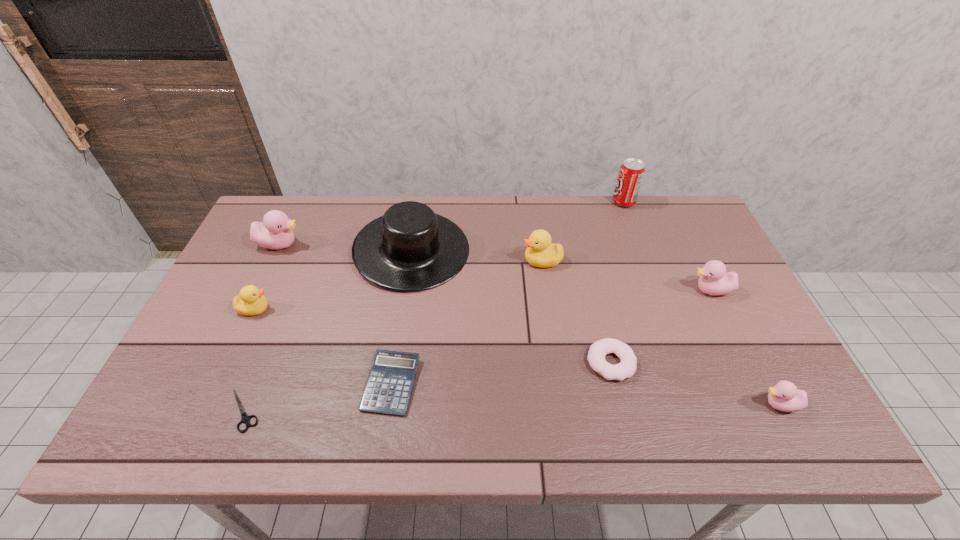
Where is `the smallest pink duckling`? the smallest pink duckling is located at coordinates (784, 396).

Where is `the nearest duckling`? This screenshot has width=960, height=540. the nearest duckling is located at coordinates (784, 396).

The height and width of the screenshot is (540, 960). I want to click on the eighth tallest object, so click(626, 368).

At what (x,y) coordinates should I click in order to perform the action: click on the fourth object from right to left. Please return your answer as a coordinate pair (x, y). Looking at the image, I should click on (626, 368).

Where is `calculator`? The image size is (960, 540). calculator is located at coordinates (389, 386).

The height and width of the screenshot is (540, 960). I want to click on black shears, so click(245, 418).

Find the location of `shears`. shears is located at coordinates (245, 418).

The image size is (960, 540). In order to click on vacant space located 0.190m on the left of the farthest object in this screenshot , I will do `click(557, 202)`.

Where is `vacant space situated on the right of the dress hat`? vacant space situated on the right of the dress hat is located at coordinates (584, 251).

Where is `vacant space located on the front-facing side of the leftmost pink duckling`? The height and width of the screenshot is (540, 960). vacant space located on the front-facing side of the leftmost pink duckling is located at coordinates (378, 244).